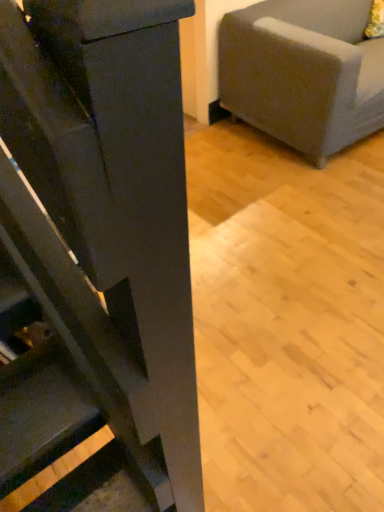
What is the approximate width of gray fabric couch at upper right?

The width of gray fabric couch at upper right is 35.07 inches.

Describe the element at coordinates (303, 72) in the screenshot. I see `gray fabric couch at upper right` at that location.

Where is `gray fabric couch at upper right`? Image resolution: width=384 pixels, height=512 pixels. gray fabric couch at upper right is located at coordinates (303, 72).

Image resolution: width=384 pixels, height=512 pixels. In order to click on gray fabric couch at upper right in this screenshot , I will do coord(303,72).